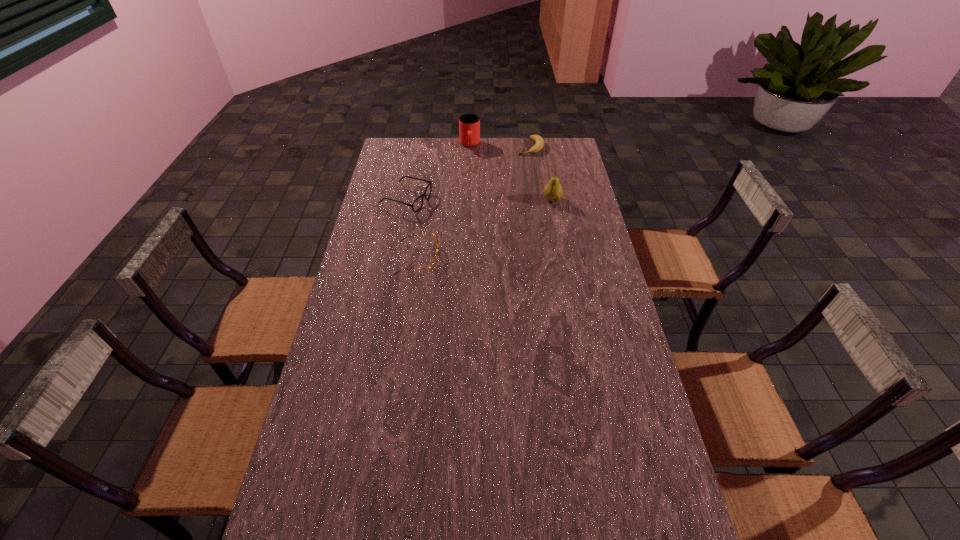
The image size is (960, 540). I want to click on vacant point located on the handle side of the cup, so click(x=474, y=198).

This screenshot has height=540, width=960. I want to click on free space located 0.370m on the handle side of the cup, so click(474, 199).

What are the coordinates of `vacant area situated 0.280m on the handle side of the cup` in the screenshot? It's located at (473, 187).

Where is `vacant space located at the stem of the banana`? Image resolution: width=960 pixels, height=540 pixels. vacant space located at the stem of the banana is located at coordinates pos(516,178).

You are a GUI agent. You are given a task and a screenshot of the screen. Output one action in this format:
    pyautogui.click(x=<x>, y=<y>)
    Task: Click on the vacant space located at the stem of the banana
    Image resolution: width=960 pixels, height=540 pixels.
    Given the screenshot: What is the action you would take?
    pyautogui.click(x=504, y=204)

Locate an element on the screen. vacant space positioned at the stem of the banana is located at coordinates (518, 174).

The width and height of the screenshot is (960, 540). Find the location of `cup that is at the far edge`. cup that is at the far edge is located at coordinates (469, 124).

Locate an element on the screen. This screenshot has width=960, height=540. banana that is at the far edge is located at coordinates (538, 146).

Find the location of a particular element. The image size is (960, 540). pear that is positioned at the right edge is located at coordinates (553, 191).

Locate an element on the screen. banana at the right edge is located at coordinates (538, 146).